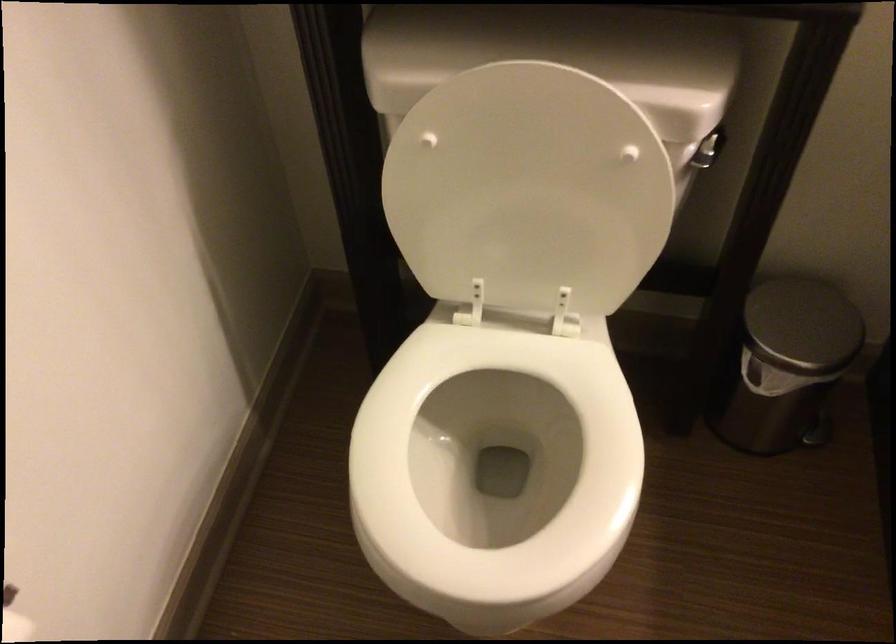
At what (x,y) coordinates should I click in order to perform the action: click on white toilet lid. Please return your answer as a coordinate pair (x, y). The image size is (896, 644). Looking at the image, I should click on (528, 189).